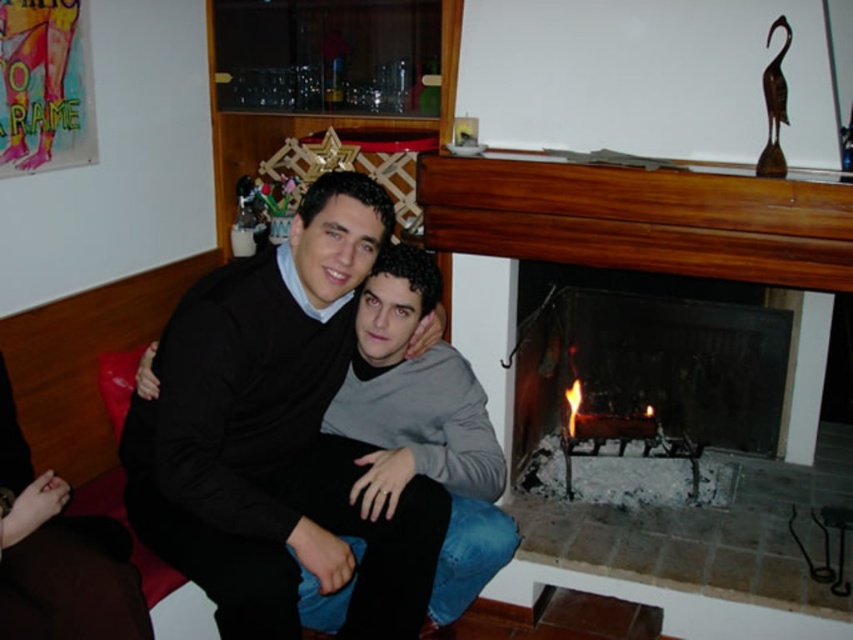
You are standing in the living room and want to place a 1.2 meter wide painting on the wall. The painting must be centered between the charcoal gray stone fireplace at right and the left wall. Is there enough space for the painting?

The charcoal gray stone fireplace at right is positioned at point 0.609 on the horizontal axis. To determine if there is enough space, calculate the distance between the fireplace and the left wall. If the distance is at least 1.2 meters, then yes. However, without knowing the exact dimensions of the room, it is impossible to confirm. Please provide more information about the room size.

You are standing in the living room and want to place a decorative vase on the charcoal gray stone fireplace at right. You notice the gray matte sweater at center is in the way. Which object is closer to you so you can decide where to place the vase?

The charcoal gray stone fireplace at right is closer to you than the gray matte sweater at center, so you can place the vase on it without moving the sweater.